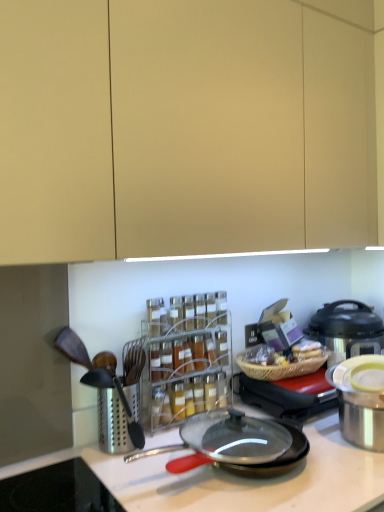
Question: From the image's perspective, would you say metallic silver pot at right, arranged as the first appliance when viewed from the back, is positioned over metallic silver pressure cooker at right?

Choices:
 (A) no
 (B) yes

Answer: (A)

Question: Is metallic silver pot at right, which ranks as the 2th appliance in front-to-back order, positioned in front of metallic silver pressure cooker at right?

Choices:
 (A) yes
 (B) no

Answer: (A)

Question: Is metallic silver pot at right, which ranks as the 2th appliance in front-to-back order, to the right of metallic silver pressure cooker at right from the viewer's perspective?

Choices:
 (A) yes
 (B) no

Answer: (B)

Question: Can you confirm if metallic silver pot at right, which ranks as the 2th appliance in front-to-back order, is thinner than metallic silver pressure cooker at right?

Choices:
 (A) yes
 (B) no

Answer: (B)

Question: Does metallic silver pot at right, arranged as the first appliance when viewed from the back, appear on the left side of metallic silver pressure cooker at right?

Choices:
 (A) no
 (B) yes

Answer: (B)

Question: Can you confirm if metallic silver pot at right, which ranks as the 2th appliance in front-to-back order, is shorter than metallic silver pressure cooker at right?

Choices:
 (A) no
 (B) yes

Answer: (B)

Question: Considering the relative positions of stainless steel grater at left and stainless steel pot at right, the 1th appliance positioned from the front, in the image provided, is stainless steel grater at left to the right of stainless steel pot at right, the 1th appliance positioned from the front, from the viewer's perspective?

Choices:
 (A) no
 (B) yes

Answer: (A)

Question: Does stainless steel grater at left lie in front of stainless steel pot at right, the 1th appliance positioned from the front?

Choices:
 (A) yes
 (B) no

Answer: (B)

Question: Does stainless steel grater at left have a smaller size compared to stainless steel pot at right, the second appliance viewed from the back?

Choices:
 (A) no
 (B) yes

Answer: (B)

Question: Could you tell me if stainless steel grater at left is turned towards stainless steel pot at right, the 1th appliance positioned from the front?

Choices:
 (A) yes
 (B) no

Answer: (B)

Question: Does stainless steel grater at left have a lesser height compared to stainless steel pot at right, the 1th appliance positioned from the front?

Choices:
 (A) yes
 (B) no

Answer: (B)

Question: From the image's perspective, is stainless steel grater at left under stainless steel pot at right, the 1th appliance positioned from the front?

Choices:
 (A) yes
 (B) no

Answer: (A)

Question: Can you confirm if metallic silver pressure cooker at right is shorter than stainless steel pot at right, the 1th appliance positioned from the front?

Choices:
 (A) no
 (B) yes

Answer: (A)